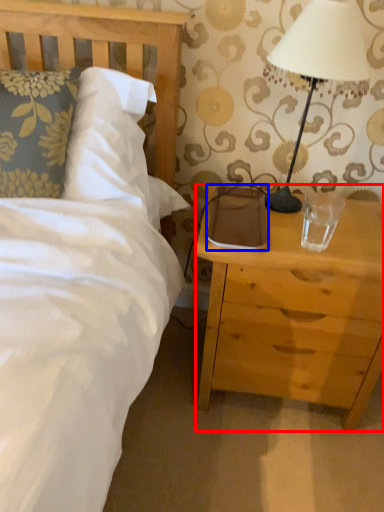
Question: Which object is further to the camera taking this photo, nightstand (highlighted by a red box) or pad (highlighted by a blue box)?

Choices:
 (A) nightstand
 (B) pad

Answer: (B)